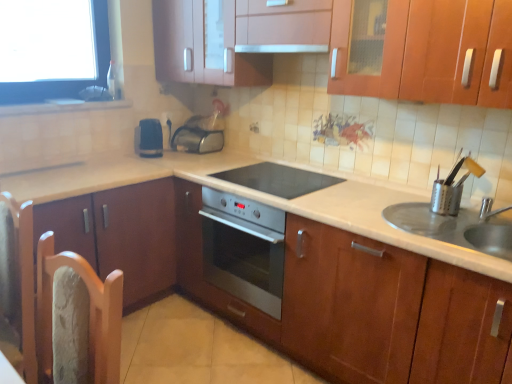
Locate an element on the screen. The image size is (512, 384). free space above wooden cabinet at left, which ranks as the 2th cabinetry in right-to-left order (from a real-world perspective) is located at coordinates (83, 172).